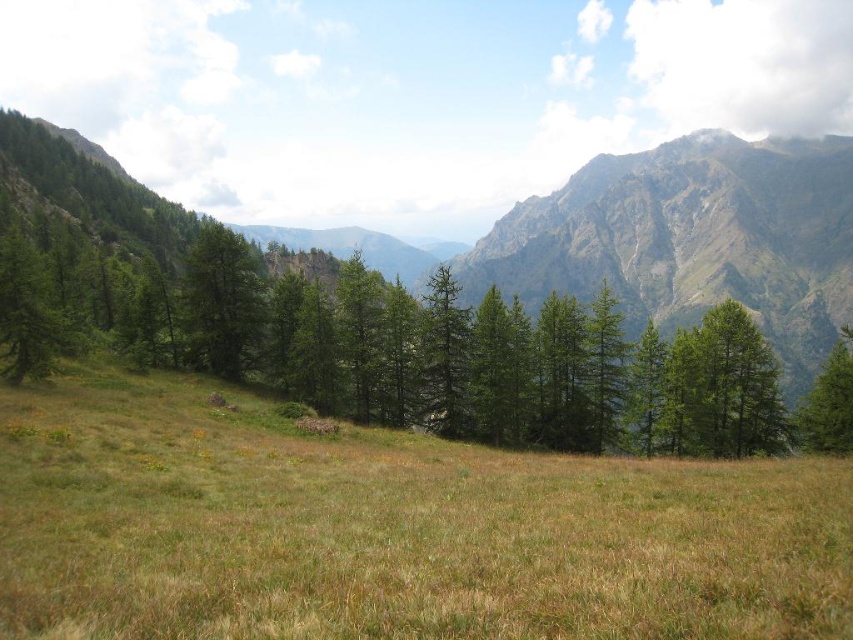
Can you confirm if green matte tree at upper left is wider than green matte tree at right?

In fact, green matte tree at upper left might be narrower than green matte tree at right.

Which is more to the right, green matte tree at upper left or green matte tree at right?

green matte tree at right is more to the right.

Does point (258, 332) come farther from viewer compared to point (825, 440)?

Yes.

The height and width of the screenshot is (640, 853). I want to click on green matte tree at upper left, so click(x=222, y=301).